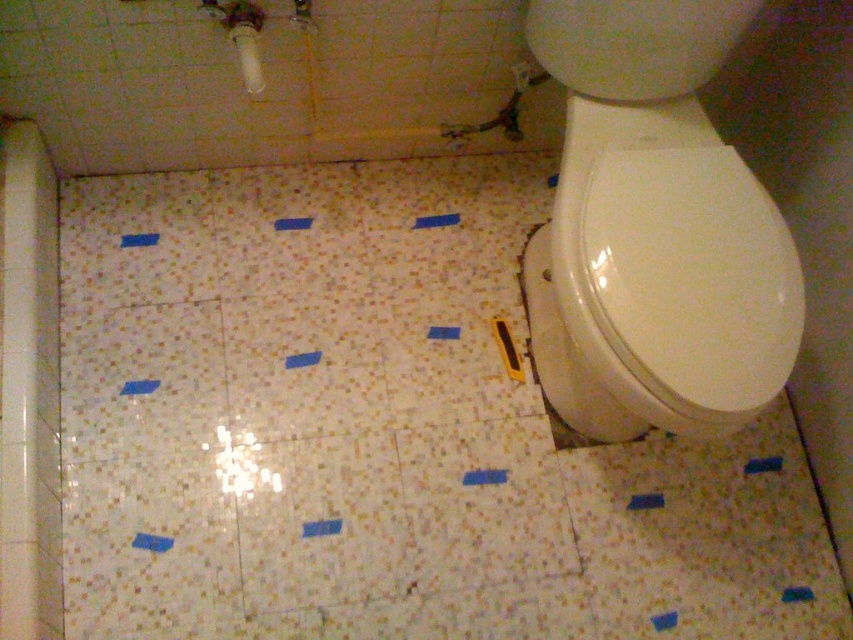
Between white glossy toilet at right and white matte toilet paper at upper left, which one is positioned lower?

white glossy toilet at right

Which is above, white glossy toilet at right or white matte toilet paper at upper left?

white matte toilet paper at upper left

Which is in front, point (616, 161) or point (242, 38)?

Point (616, 161)

The image size is (853, 640). Identify the location of white glossy toilet at right. (654, 230).

Who is more distant from viewer, (674, 173) or (259, 60)?

The point (259, 60) is behind.

Is point (759, 244) farther from viewer compared to point (241, 45)?

No, (759, 244) is in front of (241, 45).

This screenshot has width=853, height=640. I want to click on white glossy toilet lid at right, so click(x=691, y=276).

Can you confirm if white glossy toilet at right is bigger than white glossy toilet lid at right?

Yes, white glossy toilet at right is bigger than white glossy toilet lid at right.

Who is positioned more to the right, white glossy toilet at right or white glossy toilet lid at right?

white glossy toilet lid at right is more to the right.

The image size is (853, 640). In order to click on white glossy toilet at right in this screenshot , I will do 654,230.

Find the location of `white glossy toilet at right`. white glossy toilet at right is located at coordinates (654, 230).